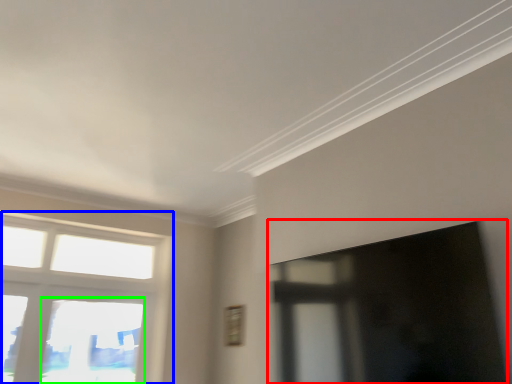
Question: Which object is positioned farthest from window screen (highlighted by a red box)? Select from window (highlighted by a blue box) and window (highlighted by a green box).

Choices:
 (A) window
 (B) window

Answer: (A)